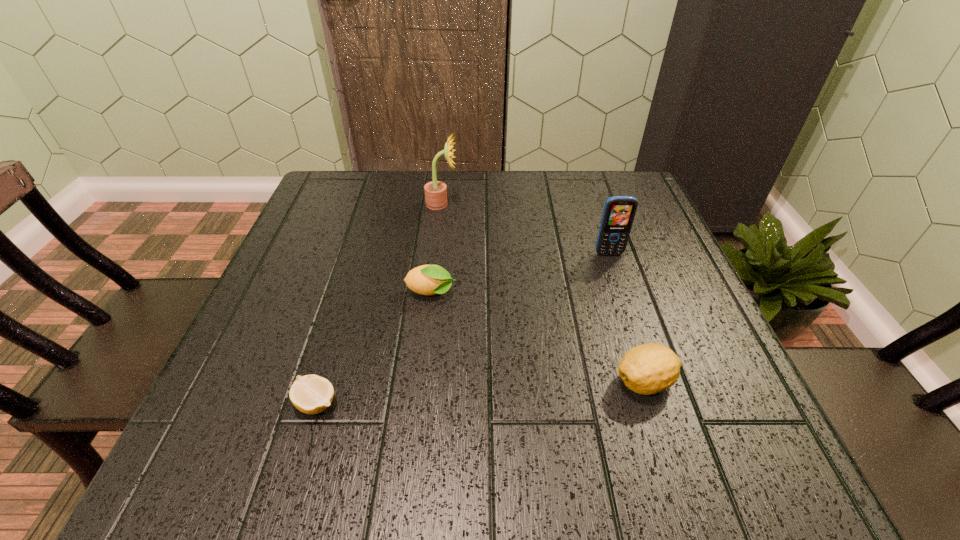
Where is `vacant area that lies between the leftmost object and the rightmost lemon`? vacant area that lies between the leftmost object and the rightmost lemon is located at coordinates (481, 393).

At what (x,y) coordinates should I click in order to perform the action: click on empty space that is in between the rightmost lemon and the farthest lemon. Please return your answer as a coordinate pair (x, y). This screenshot has height=540, width=960. Looking at the image, I should click on (538, 337).

This screenshot has height=540, width=960. I want to click on free space between the cellular telephone and the shortest lemon, so click(463, 328).

Locate an element on the screen. vacant space that's between the sunflower and the rightmost lemon is located at coordinates (543, 293).

I want to click on free space between the second farthest object and the sunflower, so click(525, 229).

Identify the location of vacant space in between the shortest lemon and the second lemon from right to left. The height and width of the screenshot is (540, 960). (373, 348).

Select which object appears as the third closest to the leftmost object. Please provide its 2D coordinates. Your answer should be formatted as a tuple, i.e. [(x, y)], where the tuple contains the x and y coordinates of a point satisfying the conditions above.

[(436, 191)]

Identify the location of object that can be found as the third closest to the farthest object. Image resolution: width=960 pixels, height=540 pixels. tap(311, 394).

At what (x,y) coordinates should I click in order to perform the action: click on lemon that is the second closest to the cellular telephone. Please return your answer as a coordinate pair (x, y). The width and height of the screenshot is (960, 540). Looking at the image, I should click on (428, 280).

Identify which lemon is the second closest to the leftmost lemon. Please provide its 2D coordinates. Your answer should be formatted as a tuple, i.e. [(x, y)], where the tuple contains the x and y coordinates of a point satisfying the conditions above.

[(647, 369)]